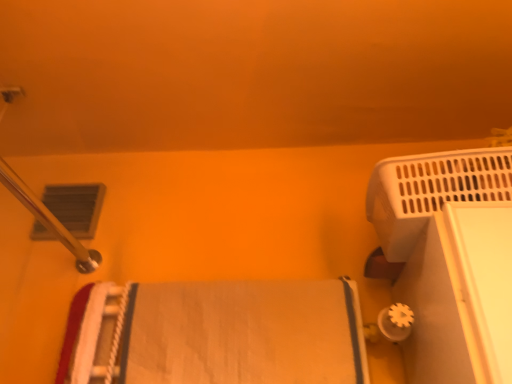
What is the approximate width of white fabric at center?

white fabric at center is 2.17 inches wide.

Describe the element at coordinates (215, 333) in the screenshot. The image size is (512, 384). I see `white fabric at center` at that location.

Locate an element on the screen. This screenshot has width=512, height=384. white fabric at center is located at coordinates (x=215, y=333).

Identify the location of white fabric at center. This screenshot has width=512, height=384. (215, 333).